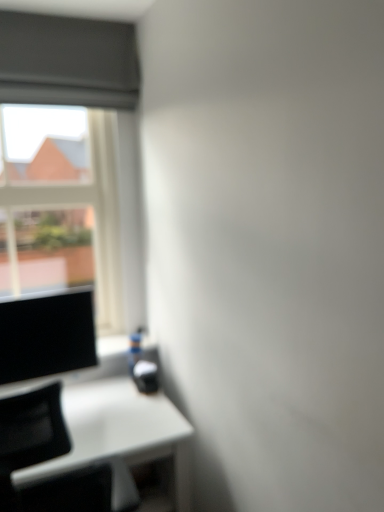
Question: From the image's perspective, is matte black monitor at left on top of white glossy table at lower left?

Choices:
 (A) no
 (B) yes

Answer: (B)

Question: From a real-world perspective, is matte black monitor at left over white glossy table at lower left?

Choices:
 (A) yes
 (B) no

Answer: (A)

Question: Does matte black monitor at left have a greater height compared to white glossy table at lower left?

Choices:
 (A) yes
 (B) no

Answer: (B)

Question: Is matte black monitor at left facing towards white glossy table at lower left?

Choices:
 (A) no
 (B) yes

Answer: (A)

Question: Does matte black monitor at left appear on the left side of white glossy table at lower left?

Choices:
 (A) no
 (B) yes

Answer: (B)

Question: From the image's perspective, relative to matte black monitor at left, is white glossy table at lower left above or below?

Choices:
 (A) below
 (B) above

Answer: (A)

Question: Is point (34, 474) closer or farther from the camera than point (69, 351)?

Choices:
 (A) farther
 (B) closer

Answer: (B)

Question: Is white glossy table at lower left taller or shorter than matte black monitor at left?

Choices:
 (A) short
 (B) tall

Answer: (B)

Question: Is white glossy table at lower left situated inside matte black monitor at left or outside?

Choices:
 (A) outside
 (B) inside

Answer: (A)

Question: From a real-world perspective, relative to white glossy table at lower left, is transparent glass window at upper left vertically above or below?

Choices:
 (A) above
 (B) below

Answer: (A)

Question: Is transparent glass window at upper left to the left or to the right of white glossy table at lower left in the image?

Choices:
 (A) left
 (B) right

Answer: (A)

Question: Based on their sizes in the image, would you say transparent glass window at upper left is bigger or smaller than white glossy table at lower left?

Choices:
 (A) big
 (B) small

Answer: (B)

Question: Considering their positions, is transparent glass window at upper left located in front of or behind white glossy table at lower left?

Choices:
 (A) front
 (B) behind

Answer: (B)

Question: Is matte black monitor at left inside the boundaries of white glossy table at lower left, or outside?

Choices:
 (A) inside
 (B) outside

Answer: (B)

Question: Relative to white glossy table at lower left, is matte black monitor at left in front or behind?

Choices:
 (A) behind
 (B) front

Answer: (A)